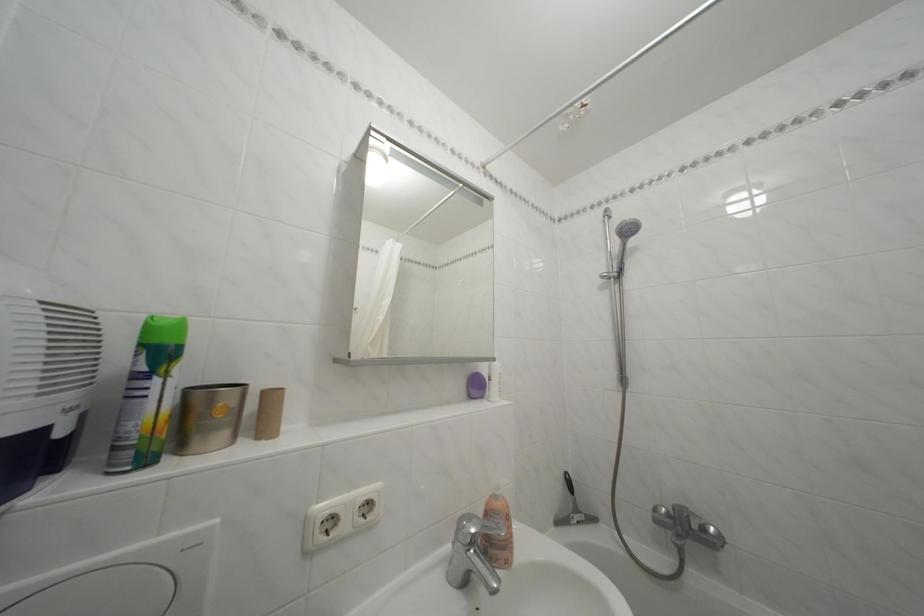
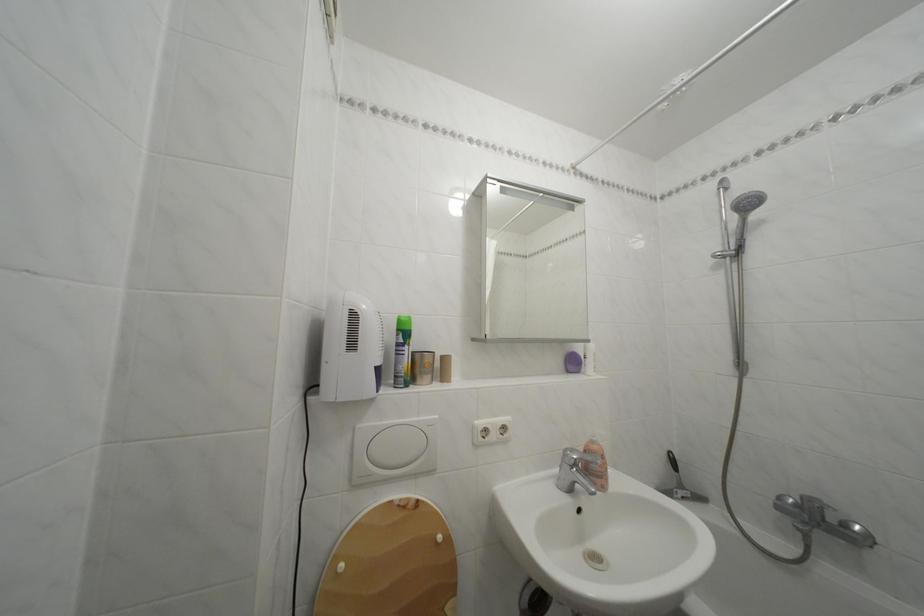
In the second image, find the point that corresponds to (578,491) in the first image.

(682, 468)